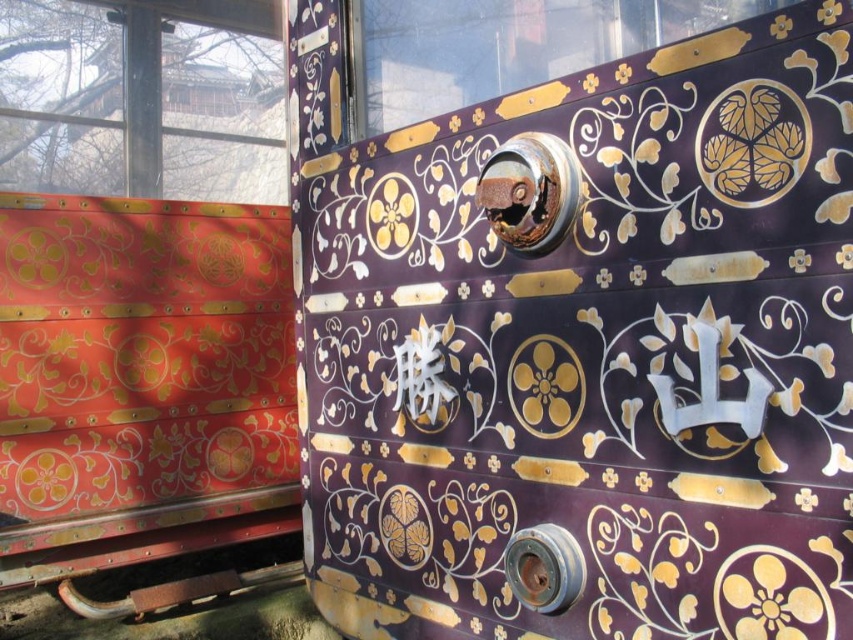
You are an architect designing a new traditional Japanese building and want to incorporate elements from this image. If you plan to place a decorative element above the purple lacquered door at center, where should it be positioned relative to the transparent glass window at upper left?

The purple lacquered door at center is below the transparent glass window at upper left, so the decorative element should be placed above the purple lacquered door at center, aligning it with the transparent glass window at upper left to maintain the existing spatial relationship.

You are an architect examining a traditional Japanese structure. You notice two points marked on the panels. The first point is at coordinates point (749, 618) and the second is at point (39, 147). Which point is nearer to you?

Point (749, 618) is closer to the viewer than point (39, 147).

Looking at the traditional Japanese structure, where is the transparent glass window at upper left located in terms of coordinates?

The transparent glass window at upper left is located at point (142,99).